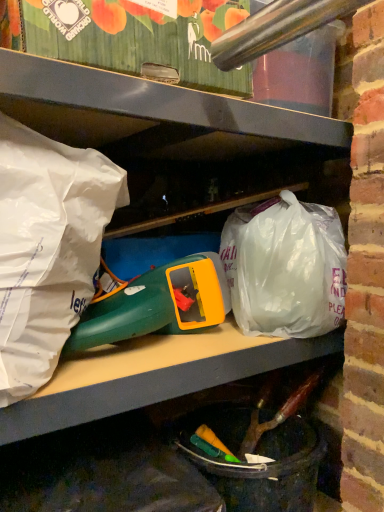
Question: Is green plastic toy at center far away from translucent plastic bag at center, which is the 1th plastic bag from back to front?

Choices:
 (A) no
 (B) yes

Answer: (A)

Question: Can you see green plastic toy at center touching translucent plastic bag at center, which is the second plastic bag from left to right?

Choices:
 (A) no
 (B) yes

Answer: (A)

Question: Is green plastic toy at center oriented away from translucent plastic bag at center, the 1th plastic bag viewed from the right?

Choices:
 (A) yes
 (B) no

Answer: (B)

Question: Is green plastic toy at center bigger than translucent plastic bag at center, the 1th plastic bag viewed from the right?

Choices:
 (A) no
 (B) yes

Answer: (A)

Question: Considering the relative positions of green plastic toy at center and translucent plastic bag at center, which is the second plastic bag from left to right, in the image provided, is green plastic toy at center to the right of translucent plastic bag at center, which is the second plastic bag from left to right, from the viewer's perspective?

Choices:
 (A) no
 (B) yes

Answer: (A)

Question: Is point (130, 336) positioned closer to the camera than point (91, 159)?

Choices:
 (A) farther
 (B) closer

Answer: (A)

Question: From a real-world perspective, relative to white paper bag at left, which is the 1th plastic bag from front to back, is green plastic toy at center vertically above or below?

Choices:
 (A) above
 (B) below

Answer: (B)

Question: Looking at their shapes, would you say green plastic toy at center is wider or thinner than white paper bag at left, placed as the 1th plastic bag when sorted from left to right?

Choices:
 (A) thin
 (B) wide

Answer: (A)

Question: Considering the positions of green plastic toy at center and white paper bag at left, which is the second plastic bag in back-to-front order, in the image, is green plastic toy at center taller or shorter than white paper bag at left, which is the second plastic bag in back-to-front order,?

Choices:
 (A) short
 (B) tall

Answer: (A)

Question: Looking at their shapes, would you say white paper bag at left, which is the second plastic bag in back-to-front order, is wider or thinner than translucent plastic bag at center, acting as the 2th plastic bag starting from the front?

Choices:
 (A) thin
 (B) wide

Answer: (A)

Question: In terms of size, does white paper bag at left, placed as the 1th plastic bag when sorted from left to right, appear bigger or smaller than translucent plastic bag at center, acting as the 2th plastic bag starting from the front?

Choices:
 (A) big
 (B) small

Answer: (B)

Question: From the image's perspective, is white paper bag at left, placed as the 1th plastic bag when sorted from left to right, located above or below translucent plastic bag at center, acting as the 2th plastic bag starting from the front?

Choices:
 (A) above
 (B) below

Answer: (A)

Question: Is white paper bag at left, placed as the 1th plastic bag when sorted from left to right, situated inside translucent plastic bag at center, which is the 1th plastic bag from back to front, or outside?

Choices:
 (A) inside
 (B) outside

Answer: (B)

Question: In terms of width, does translucent plastic bag at center, the 1th plastic bag viewed from the right, look wider or thinner when compared to green plastic toy at center?

Choices:
 (A) wide
 (B) thin

Answer: (A)

Question: Is translucent plastic bag at center, which is the 1th plastic bag from back to front, inside or outside of green plastic toy at center?

Choices:
 (A) outside
 (B) inside

Answer: (A)